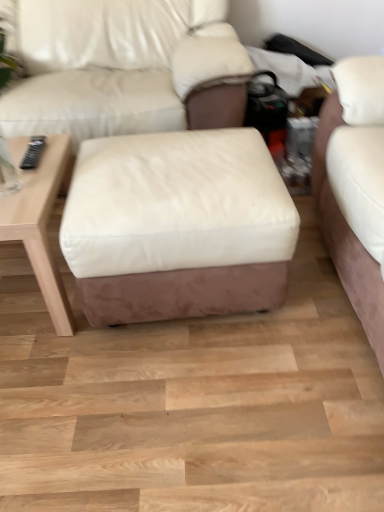
Question: Is wooden table at left thinner than white leather ottoman at center?

Choices:
 (A) yes
 (B) no

Answer: (A)

Question: Is wooden table at left to the left of white leather ottoman at center from the viewer's perspective?

Choices:
 (A) no
 (B) yes

Answer: (B)

Question: Is wooden table at left facing towards white leather ottoman at center?

Choices:
 (A) yes
 (B) no

Answer: (B)

Question: Considering the relative positions of wooden table at left and white leather ottoman at center in the image provided, is wooden table at left to the right of white leather ottoman at center from the viewer's perspective?

Choices:
 (A) no
 (B) yes

Answer: (A)

Question: Would you say wooden table at left is a long distance from white leather ottoman at center?

Choices:
 (A) no
 (B) yes

Answer: (A)

Question: Is wooden table at left to the left or to the right of white leather ottoman at center in the image?

Choices:
 (A) right
 (B) left

Answer: (B)

Question: Considering the positions of point (11, 199) and point (71, 231), is point (11, 199) closer or farther from the camera than point (71, 231)?

Choices:
 (A) farther
 (B) closer

Answer: (A)

Question: From a real-world perspective, is wooden table at left positioned above or below white leather ottoman at center?

Choices:
 (A) below
 (B) above

Answer: (A)

Question: From the image's perspective, relative to white leather ottoman at center, is wooden table at left above or below?

Choices:
 (A) above
 (B) below

Answer: (B)

Question: Relative to matte white leather couch at center, is wooden table at left in front or behind?

Choices:
 (A) behind
 (B) front

Answer: (B)

Question: From the image's perspective, relative to matte white leather couch at center, is wooden table at left above or below?

Choices:
 (A) above
 (B) below

Answer: (B)

Question: Looking at their shapes, would you say wooden table at left is wider or thinner than matte white leather couch at center?

Choices:
 (A) thin
 (B) wide

Answer: (A)

Question: Choose the correct answer: Is wooden table at left inside matte white leather couch at center or outside it?

Choices:
 (A) inside
 (B) outside

Answer: (B)

Question: In the image, is matte white leather couch at center positioned in front of or behind wooden table at left?

Choices:
 (A) front
 (B) behind

Answer: (B)

Question: From the image's perspective, relative to wooden table at left, is matte white leather couch at center above or below?

Choices:
 (A) below
 (B) above

Answer: (B)